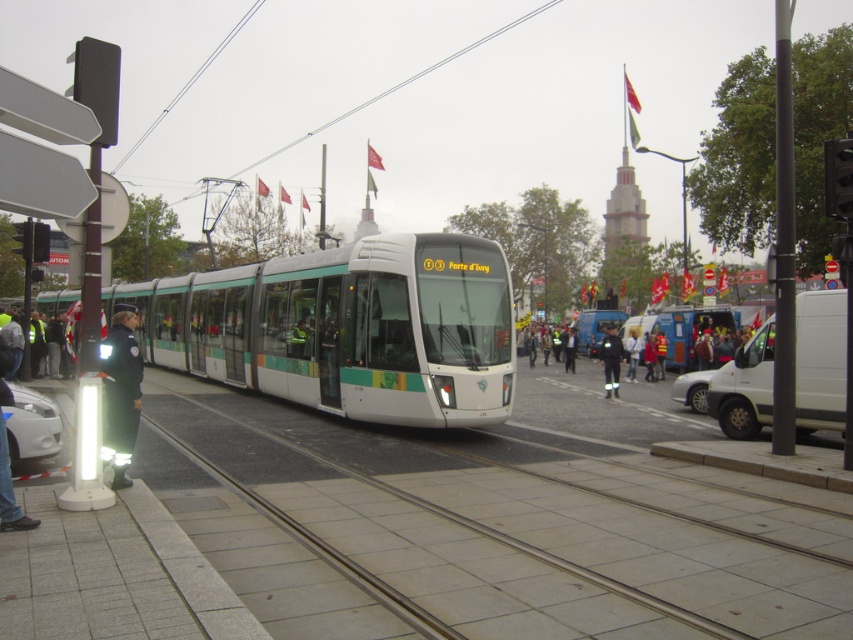
Question: Is white fabric jacket at center in front of reflective silver helmet at center?

Choices:
 (A) no
 (B) yes

Answer: (B)

Question: Which of the following is the farthest from the observer?

Choices:
 (A) reflective silver helmet at center
 (B) metallic silver bus at center
 (C) reflective green uniform at left

Answer: (A)

Question: Which of the following is the closest to the observer?

Choices:
 (A) (6, 362)
 (B) (108, 413)
 (C) (633, 371)

Answer: (A)

Question: Which object appears closest to the camera in this image?

Choices:
 (A) reflective green uniform at left
 (B) reflective blue jacket at lower left
 (C) white glossy tram at center

Answer: (B)

Question: Is white glossy tram at center above metallic silver bus at center?

Choices:
 (A) no
 (B) yes

Answer: (B)

Question: Can you confirm if dark blue uniform at center is positioned to the left of reflective silver helmet at center?

Choices:
 (A) yes
 (B) no

Answer: (B)